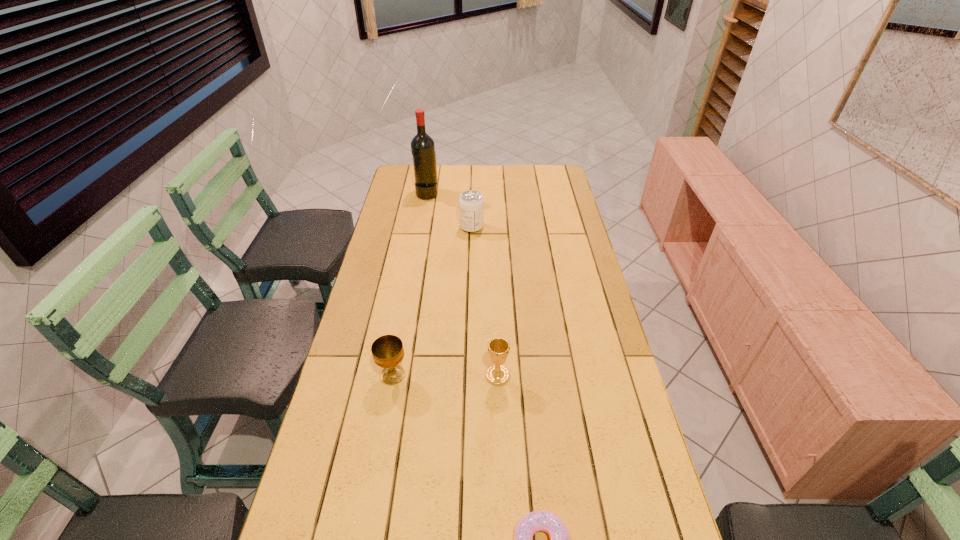
This screenshot has height=540, width=960. I want to click on object situated at the far edge, so (422, 145).

In order to click on wine bottle located at the left edge in this screenshot , I will do `click(422, 145)`.

In order to click on chalice situated at the left edge in this screenshot , I will do `click(387, 350)`.

The image size is (960, 540). In order to click on object that is at the far left corner in this screenshot , I will do `click(422, 145)`.

Where is `free space at the far edge`? This screenshot has width=960, height=540. free space at the far edge is located at coordinates (459, 185).

Locate an element on the screen. vacant space at the left edge of the desktop is located at coordinates (405, 217).

The height and width of the screenshot is (540, 960). I want to click on vacant point at the right edge, so click(x=548, y=223).

This screenshot has height=540, width=960. In order to click on vacant space at the far right corner of the desktop in this screenshot , I will do `click(559, 167)`.

This screenshot has height=540, width=960. Find the location of `free spot between the fourth nearest object and the farthest object`. free spot between the fourth nearest object and the farthest object is located at coordinates (449, 211).

Where is `vacant area that lies between the left chalice and the right chalice`? This screenshot has width=960, height=540. vacant area that lies between the left chalice and the right chalice is located at coordinates (445, 375).